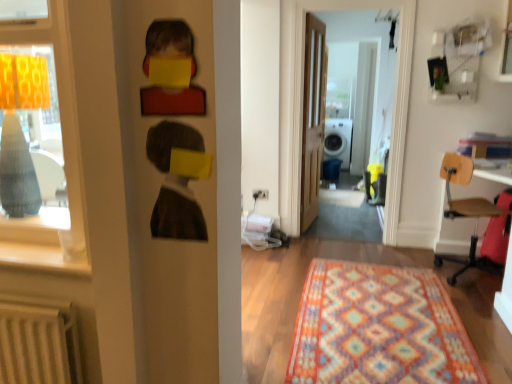
Locate an element on the screen. The height and width of the screenshot is (384, 512). vacant area that is in front of transparent glass door at center is located at coordinates (339, 251).